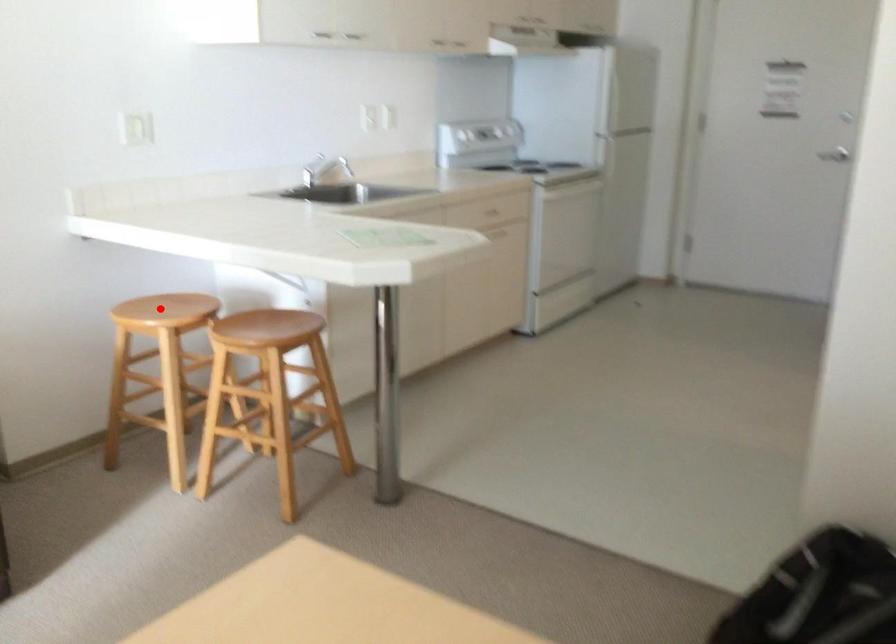
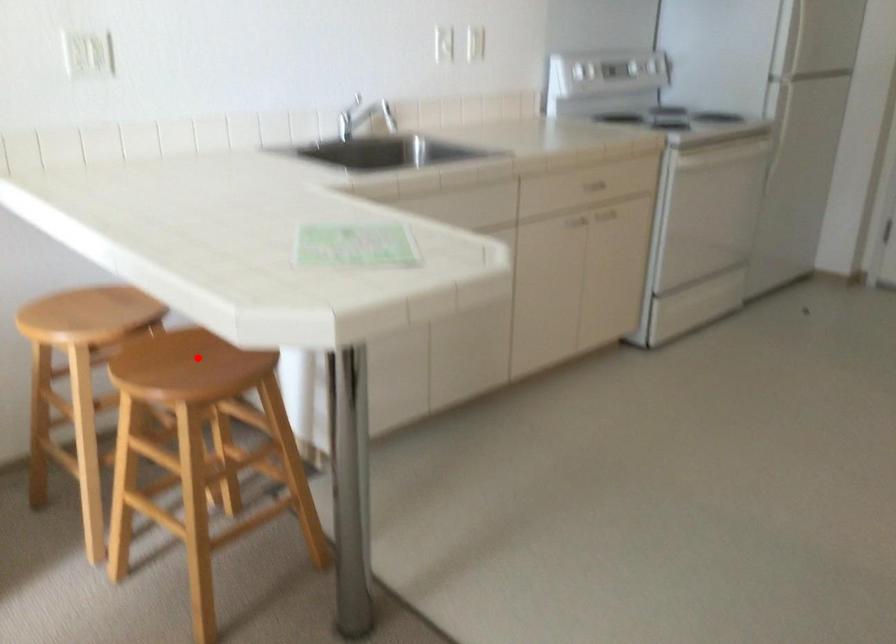
I am providing you with two images of the same scene from different viewpoints. A red point is marked on the first image and another point is marked on the second image. Are the points marked in image1 and image2 representing the same 3D position?

No